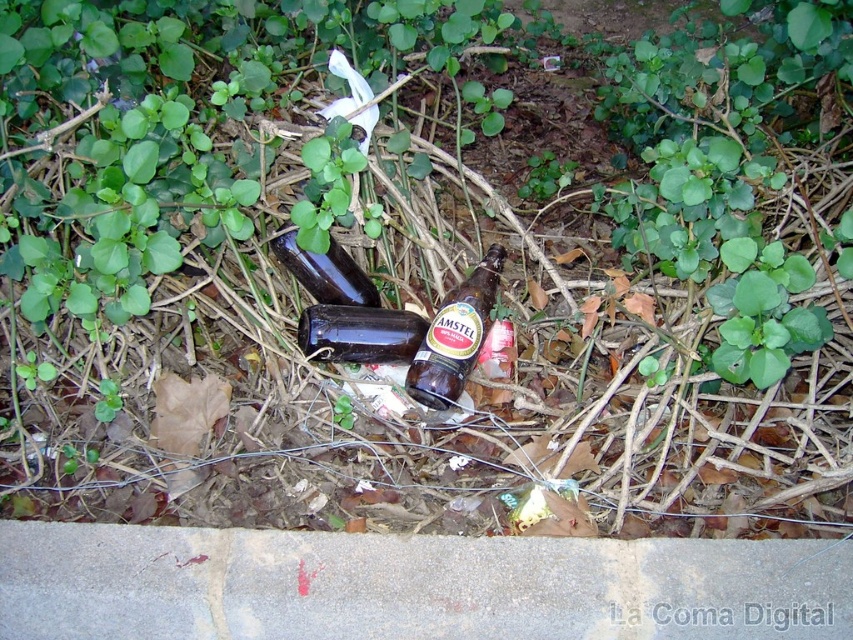
Does amber glass bottle at center have a greater width compared to shiny dark brown bottle at center?

No.

Between point (477, 307) and point (289, 252), which one is positioned behind?

Point (289, 252)

Find the location of a particular element. amber glass bottle at center is located at coordinates (456, 336).

Between concrete at lower left and amber glass bottle at center, which one has less height?

concrete at lower left is shorter.

Is concrete at lower left wider than amber glass bottle at center?

Correct, the width of concrete at lower left exceeds that of amber glass bottle at center.

Is point (821, 600) behind point (502, 248)?

That is False.

Where is `concrete at lower left`? Image resolution: width=853 pixels, height=640 pixels. concrete at lower left is located at coordinates (410, 586).

Which is in front, point (409, 390) or point (305, 324)?

Point (409, 390) is more forward.

Which is below, amber glass bottle at center or dark glass bottle at center?

dark glass bottle at center is lower down.

Does point (445, 403) come farther from viewer compared to point (300, 336)?

No, it is not.

Identify the location of amber glass bottle at center. Image resolution: width=853 pixels, height=640 pixels. (456, 336).